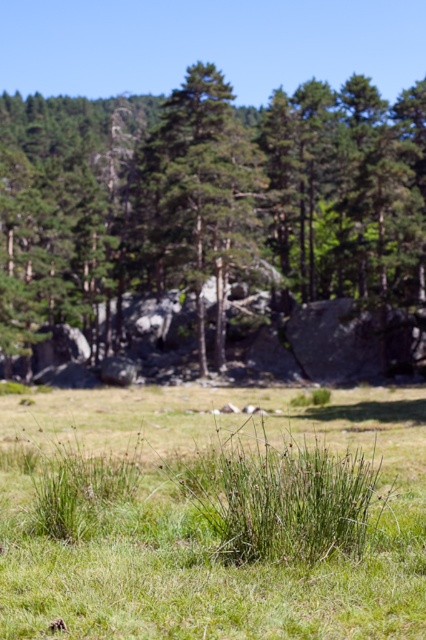
Does green leafy tree at center have a greater height compared to green grass at center?

Yes, green leafy tree at center is taller than green grass at center.

Which of these two, green leafy tree at center or green grass at center, stands taller?

green leafy tree at center is taller.

Which is behind, point (316, 272) or point (184, 400)?

Positioned behind is point (316, 272).

Find the location of `green leafy tree at center`. green leafy tree at center is located at coordinates 210,200.